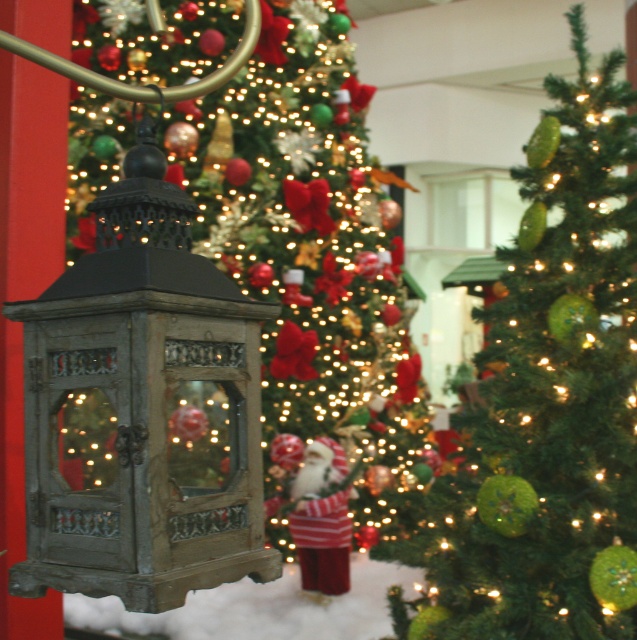
Who is higher up, green textured christmas tree at center or green textured ornaments at center?

green textured christmas tree at center

Does green textured christmas tree at center appear on the left side of green textured ornaments at center?

Correct, you'll find green textured christmas tree at center to the left of green textured ornaments at center.

Between point (396, 272) and point (548, 138), which one is positioned in front?

Point (548, 138) is more forward.

Where is `green textured christmas tree at center`? The width and height of the screenshot is (637, 640). green textured christmas tree at center is located at coordinates click(308, 232).